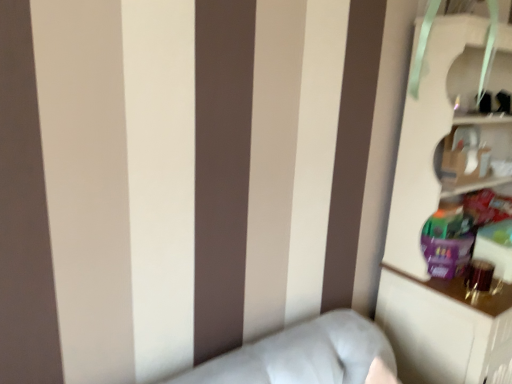
Question: Is matte cardboard cabinet at upper right to the left of white glossy bookcase at right from the viewer's perspective?

Choices:
 (A) no
 (B) yes

Answer: (B)

Question: Is matte cardboard cabinet at upper right taller than white glossy bookcase at right?

Choices:
 (A) yes
 (B) no

Answer: (B)

Question: From a real-world perspective, is matte cardboard cabinet at upper right beneath white glossy bookcase at right?

Choices:
 (A) yes
 (B) no

Answer: (B)

Question: Is white glossy bookcase at right inside matte cardboard cabinet at upper right?

Choices:
 (A) yes
 (B) no

Answer: (B)

Question: From the image's perspective, is matte cardboard cabinet at upper right above white glossy bookcase at right?

Choices:
 (A) yes
 (B) no

Answer: (A)

Question: Considering the relative sizes of matte cardboard cabinet at upper right and white glossy bookcase at right in the image provided, is matte cardboard cabinet at upper right bigger than white glossy bookcase at right?

Choices:
 (A) yes
 (B) no

Answer: (B)

Question: Can you confirm if white glossy bookcase at right is taller than matte cardboard cabinet at upper right?

Choices:
 (A) yes
 (B) no

Answer: (A)

Question: Does white glossy bookcase at right have a smaller size compared to matte cardboard cabinet at upper right?

Choices:
 (A) no
 (B) yes

Answer: (A)

Question: Is white glossy bookcase at right far from matte cardboard cabinet at upper right?

Choices:
 (A) no
 (B) yes

Answer: (A)

Question: Does white glossy bookcase at right have a lesser height compared to matte cardboard cabinet at upper right?

Choices:
 (A) no
 (B) yes

Answer: (A)

Question: Is white glossy bookcase at right looking in the opposite direction of matte cardboard cabinet at upper right?

Choices:
 (A) no
 (B) yes

Answer: (B)

Question: Is white glossy bookcase at right positioned before matte cardboard cabinet at upper right?

Choices:
 (A) yes
 (B) no

Answer: (A)

Question: Is white glossy bookcase at right bigger or smaller than matte cardboard cabinet at upper right?

Choices:
 (A) big
 (B) small

Answer: (A)